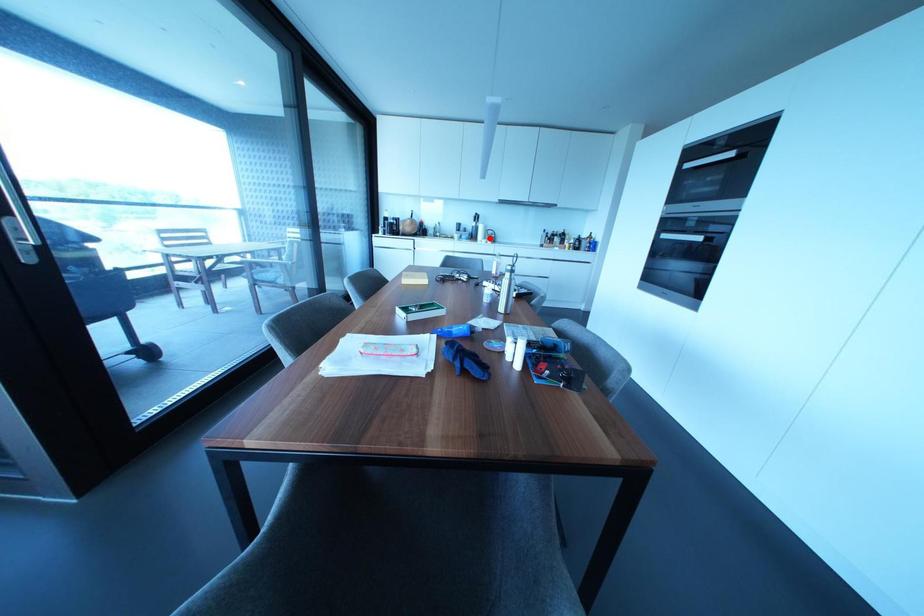
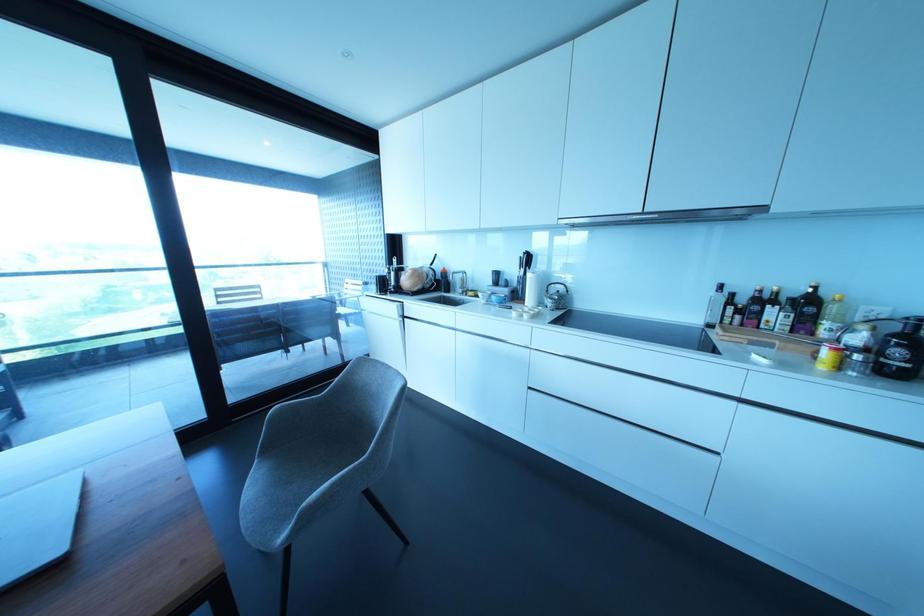
Locate, in the second image, the point that corresponds to the highlighted location in the first image.

(549, 302)